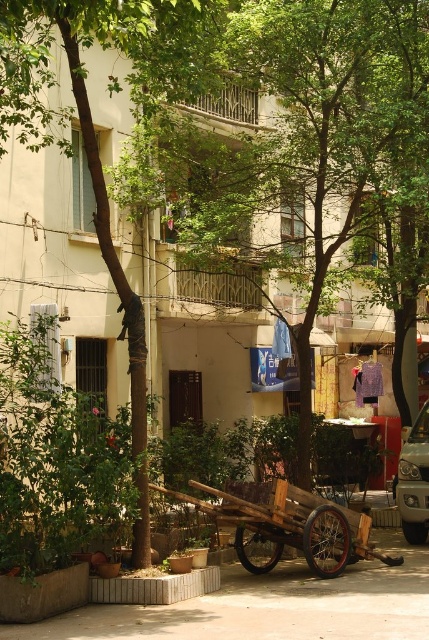
Question: Is green leafy tree at center smaller than wooden cart at center?

Choices:
 (A) no
 (B) yes

Answer: (B)

Question: Does wooden cart at center appear on the left side of silver metallic car at right?

Choices:
 (A) yes
 (B) no

Answer: (A)

Question: Estimate the real-world distances between objects in this image. Which object is farther from the silver metallic car at right?

Choices:
 (A) green leafy tree at center
 (B) wooden cart at center

Answer: (A)

Question: Considering the relative positions of green leafy tree at center and silver metallic car at right in the image provided, where is green leafy tree at center located with respect to silver metallic car at right?

Choices:
 (A) below
 (B) above

Answer: (B)

Question: Which object appears closest to the camera in this image?

Choices:
 (A) green leafy tree at center
 (B) wooden cart at center
 (C) silver metallic car at right

Answer: (B)

Question: Which of the following is the closest to the observer?

Choices:
 (A) (184, 148)
 (B) (386, 563)

Answer: (B)